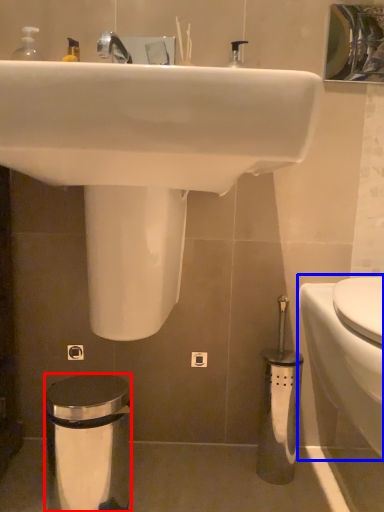
Question: Which object is closer to the camera taking this photo, trash bin/can (highlighted by a red box) or toilet (highlighted by a blue box)?

Choices:
 (A) trash bin/can
 (B) toilet

Answer: (B)